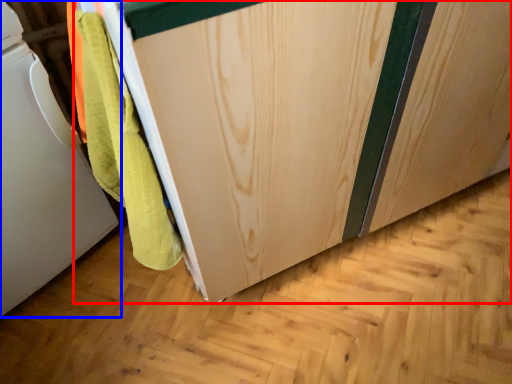
Question: Which object is further to the camera taking this photo, cabinetry (highlighted by a red box) or home appliance (highlighted by a blue box)?

Choices:
 (A) cabinetry
 (B) home appliance

Answer: (B)